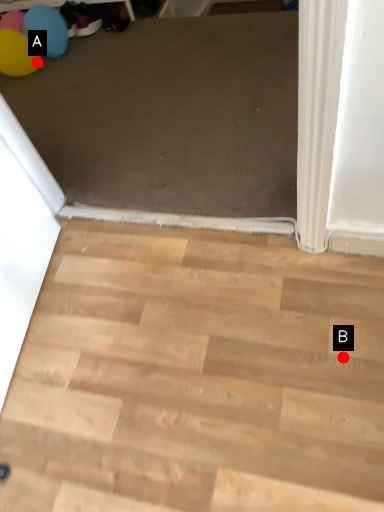
Question: Two points are circled on the image, labeled by A and B beside each circle. Which of the following is the farthest from the observer?

Choices:
 (A) A is further
 (B) B is further

Answer: (A)